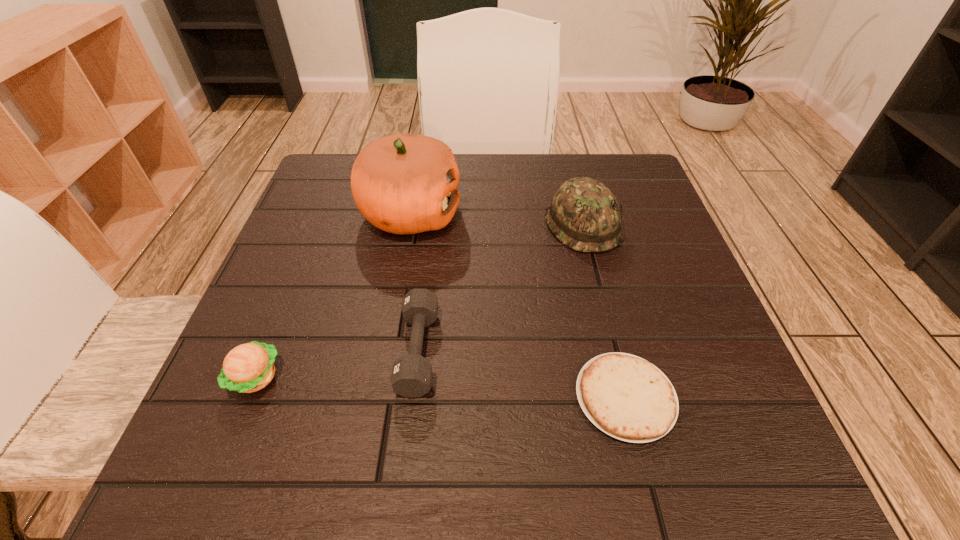
Locate an element on the screen. The height and width of the screenshot is (540, 960). vacant position at the far edge of the desktop is located at coordinates (559, 154).

The width and height of the screenshot is (960, 540). I want to click on vacant space at the near edge, so click(x=500, y=424).

In the image, there is a desktop. Find the location of `blank space at the left edge`. blank space at the left edge is located at coordinates (289, 409).

Locate an element on the screen. The image size is (960, 540). free space at the right edge of the desktop is located at coordinates (651, 342).

In the image, there is a desktop. Where is `vacant region at the far left corner`? The height and width of the screenshot is (540, 960). vacant region at the far left corner is located at coordinates (340, 157).

Find the location of `vacant region at the near left corner of the desktop`. vacant region at the near left corner of the desktop is located at coordinates (177, 488).

You are a GUI agent. You are given a task and a screenshot of the screen. Output one action in this format:
    pyautogui.click(x=<x>, y=<y>)
    Task: Click on the free space at the near right corner of the desktop
    The width and height of the screenshot is (960, 540).
    Given the screenshot: What is the action you would take?
    pyautogui.click(x=765, y=451)

I want to click on free spot between the leftmost object and the tortilla, so click(441, 387).

You are a GUI agent. You are given a task and a screenshot of the screen. Output one action in this format:
    pyautogui.click(x=<x>, y=<y>)
    Task: Click on the empty location between the tortilla and the headwear
    The height and width of the screenshot is (540, 960).
    Given the screenshot: What is the action you would take?
    pyautogui.click(x=604, y=311)

The width and height of the screenshot is (960, 540). I want to click on free space between the leftmost object and the tallest object, so click(333, 295).